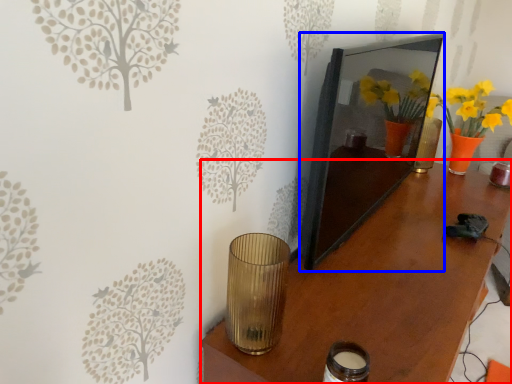
Question: Which object is further to the camera taking this photo, table (highlighted by a red box) or picture frame (highlighted by a blue box)?

Choices:
 (A) table
 (B) picture frame

Answer: (B)